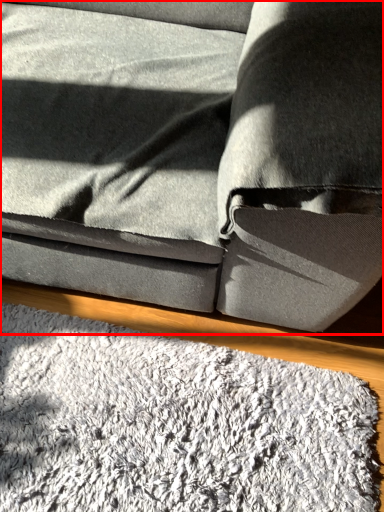
Question: From the image's perspective, what is the correct spatial relationship of studio couch (annotated by the red box) in relation to mat?

Choices:
 (A) above
 (B) below

Answer: (A)